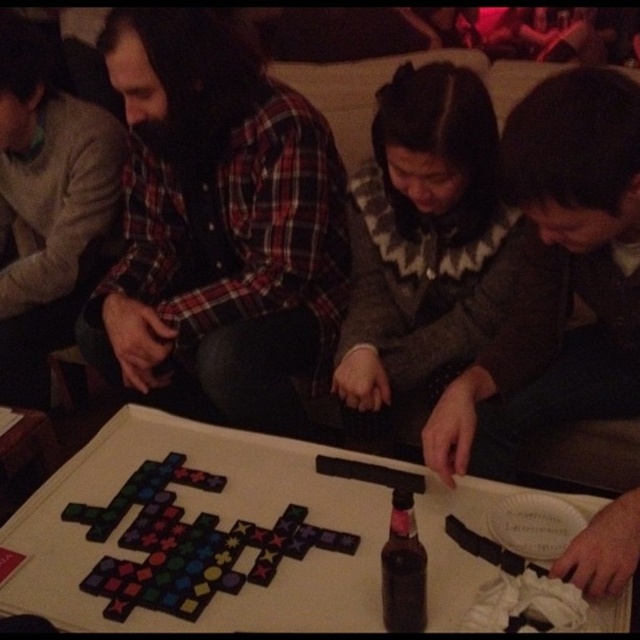
You are a guest at a party and want to place a small snack on the white matte table at center without disturbing the multicolored plastic game pieces at center. Based on their positions, is there enough space on the table to do this?

The white matte table at center is in front of the multicolored plastic game pieces at center, which means there is space between them where the snack can be placed without disturbing the game pieces.

You are a game designer who wants to ensure that the multicolored plastic game pieces at center can move freely on the white matte table at center. Given that the game pieces have a combined thickness of 0.5 inches, is there enough space between them and the table surface for movement?

The white matte table at center is 1.53 inches from multicolored plastic game pieces at center. Since the game pieces have a combined thickness of 0.5 inches, there is sufficient vertical clearance of 1.03 inches, allowing them to move freely without obstruction.

You are standing at the entrance of the room where the group is playing the board game. You want to place a new player at point (196,534). Is this point suitable for placing a new player next to the white matte table at center?

The point (196,534) is where the white matte table at center is located, so placing a new player there would not be suitable as it is occupied by the table itself.